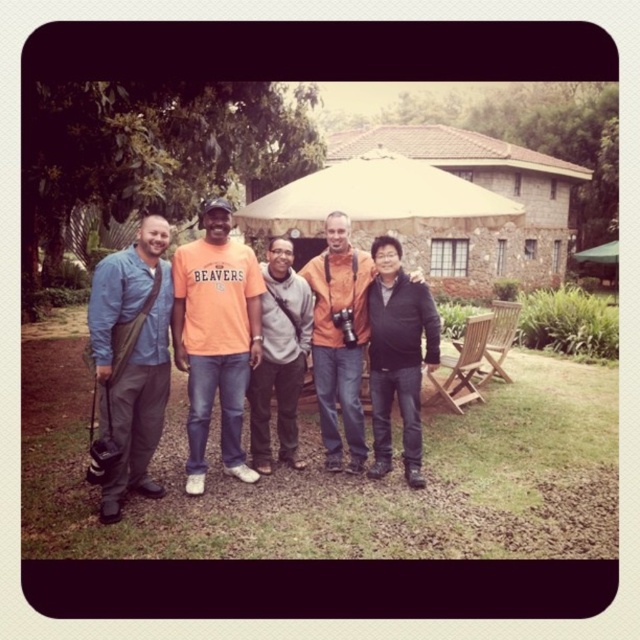
Question: Which point is closer to the camera?

Choices:
 (A) (365, 451)
 (B) (381, 348)
 (C) (115, 518)
 (D) (236, 376)

Answer: (C)

Question: Can you confirm if matte blue shirt at left is bigger than orange cotton t-shirt at center?

Choices:
 (A) yes
 (B) no

Answer: (A)

Question: Which point is closer to the camera?

Choices:
 (A) (406, 428)
 (B) (362, 316)
 (C) (157, 228)
 (D) (204, 362)

Answer: (C)

Question: Considering the relative positions of matte blue shirt at left and orange cotton shirt at center in the image provided, where is matte blue shirt at left located with respect to orange cotton shirt at center?

Choices:
 (A) below
 (B) above

Answer: (A)

Question: Among these points, which one is farthest from the camera?

Choices:
 (A) (353, 323)
 (B) (241, 458)
 (C) (252, 420)

Answer: (A)

Question: Is orange cotton t-shirt at center to the right of orange cotton shirt at center from the viewer's perspective?

Choices:
 (A) no
 (B) yes

Answer: (A)